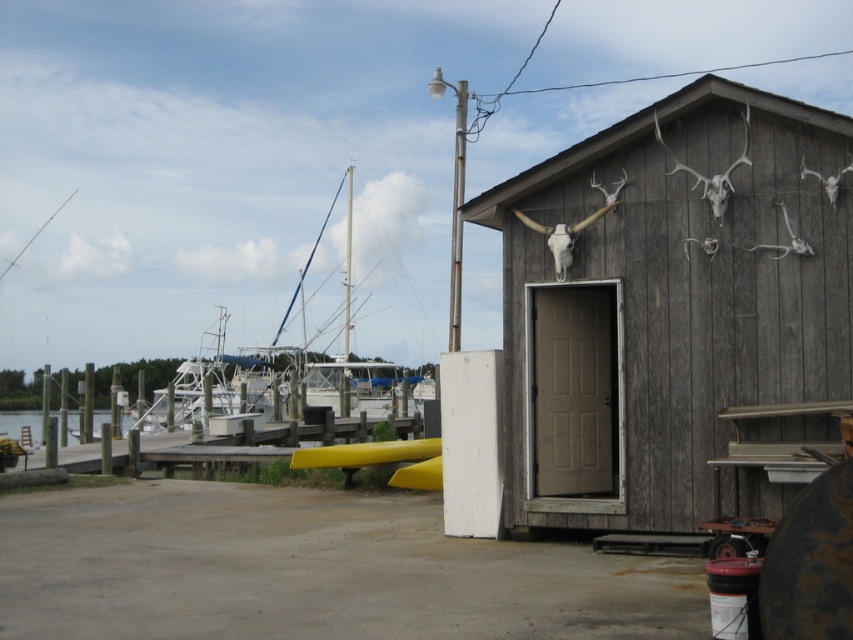
Question: From the image, what is the correct spatial relationship of weathered wood hut at center in relation to clear water at dock left?

Choices:
 (A) right
 (B) left

Answer: (A)

Question: Which object is positioned closest to the weathered wood hut at center?

Choices:
 (A) yellow plastic dock at lower center
 (B) clear water at dock left

Answer: (A)

Question: Can you confirm if yellow plastic dock at lower center is smaller than clear water at dock left?

Choices:
 (A) no
 (B) yes

Answer: (B)

Question: Does weathered wood hut at center have a greater width compared to yellow plastic dock at lower center?

Choices:
 (A) yes
 (B) no

Answer: (B)

Question: Which object is the closest to the weathered wood hut at center?

Choices:
 (A) clear water at dock left
 (B) yellow plastic dock at lower center

Answer: (B)

Question: Which of the following is the farthest from the observer?

Choices:
 (A) yellow plastic dock at lower center
 (B) clear water at dock left

Answer: (B)